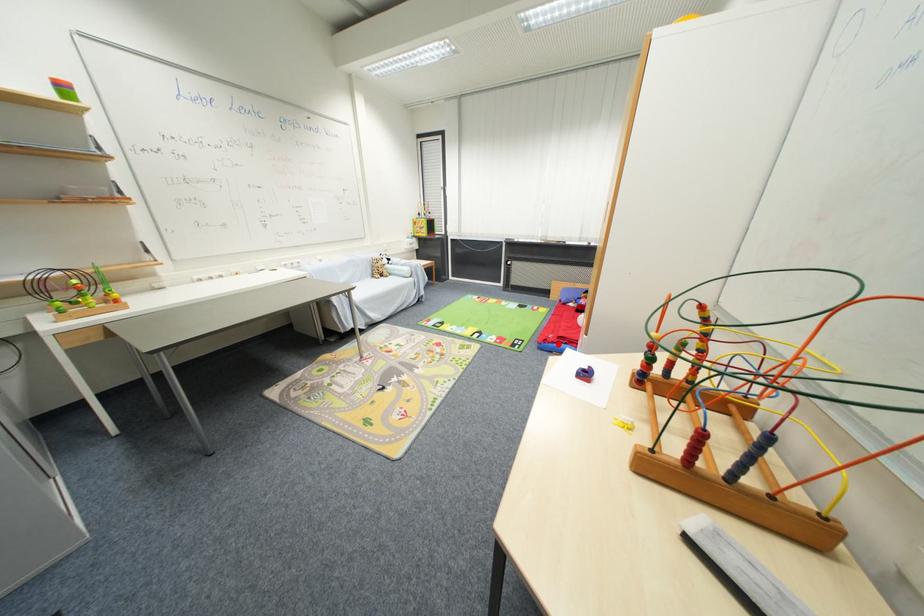
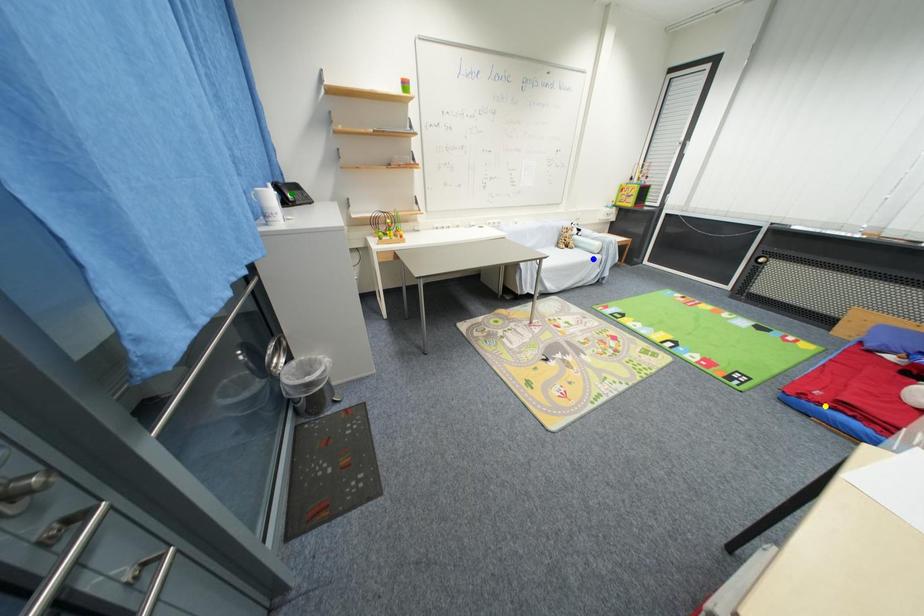
Question: I am providing you with two images of the same scene from different viewpoints. A red point is marked on the first image. You are given multiple points on the second image. In image 2, which mark is for the same physical point as the one in image 1?

Choices:
 (A) yellow point
 (B) green point
 (C) blue point

Answer: (A)